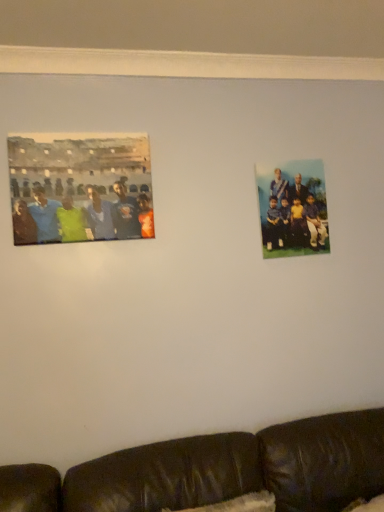
At what (x,y) coordinates should I click in order to perform the action: click on blue fabric group at upper right, which is counted as the 1th person, starting from the right. Please return your answer as a coordinate pair (x, y). This screenshot has width=384, height=512. Looking at the image, I should click on (294, 210).

At what (x,y) coordinates should I click in order to perform the action: click on black leather couch at lower center. Please return your answer as a coordinate pair (x, y). Looking at the image, I should click on click(219, 470).

What do you see at coordinates (82, 217) in the screenshot?
I see `matte green shirt at left, which is the second person from back to front` at bounding box center [82, 217].

At what (x,y) coordinates should I click in order to perform the action: click on blue fabric group at upper right, which is the 1th person in back-to-front order. Please return your answer as a coordinate pair (x, y). Looking at the image, I should click on (294, 210).

Between black leather couch at lower center and matte green shirt at left, the first person in the front-to-back sequence, which one has larger size?

Bigger between the two is black leather couch at lower center.

Is black leather couch at lower center facing away from matte green shirt at left, which is the second person from back to front?

black leather couch at lower center does not have its back to matte green shirt at left, which is the second person from back to front.

Consider the image. From the image's perspective, is black leather couch at lower center below matte green shirt at left, placed as the 1th person when sorted from left to right?

Indeed, from the image's perspective, black leather couch at lower center is shown beneath matte green shirt at left, placed as the 1th person when sorted from left to right.

Is black leather couch at lower center further to camera compared to matte green shirt at left, which is the second person from back to front?

No.

Between blue fabric group at upper right, which is counted as the 1th person, starting from the right, and matte green shirt at left, which is the second person from back to front, which one has smaller size?

blue fabric group at upper right, which is counted as the 1th person, starting from the right.

Is the position of blue fabric group at upper right, which is counted as the 1th person, starting from the right, more distant than that of matte green shirt at left, which is the 2th person from right to left?

Yes, it is.

Does point (313, 216) come behind point (119, 197)?

Yes, point (313, 216) is behind point (119, 197).

Between point (61, 204) and point (241, 472), which one is positioned behind?

Point (61, 204)

Considering the relative sizes of matte green shirt at left, placed as the 1th person when sorted from left to right, and black leather couch at lower center in the image provided, is matte green shirt at left, placed as the 1th person when sorted from left to right, thinner than black leather couch at lower center?

Yes.

Could you tell me if matte green shirt at left, which is the 2th person from right to left, is turned towards black leather couch at lower center?

No, matte green shirt at left, which is the 2th person from right to left, is not turned towards black leather couch at lower center.

Is matte green shirt at left, placed as the 1th person when sorted from left to right, not inside black leather couch at lower center?

matte green shirt at left, placed as the 1th person when sorted from left to right, is positioned outside black leather couch at lower center.

Considering their positions, is blue fabric group at upper right, which is counted as the 1th person, starting from the right, located in front of or behind black leather couch at lower center?

blue fabric group at upper right, which is counted as the 1th person, starting from the right, is positioned farther from the viewer than black leather couch at lower center.

From the image's perspective, would you say blue fabric group at upper right, the second person when ordered from left to right, is positioned over black leather couch at lower center?

Indeed, from the image's perspective, blue fabric group at upper right, the second person when ordered from left to right, is shown above black leather couch at lower center.

How far apart are blue fabric group at upper right, the second person when ordered from left to right, and black leather couch at lower center?

blue fabric group at upper right, the second person when ordered from left to right, and black leather couch at lower center are 34.29 inches apart.

Is black leather couch at lower center inside blue fabric group at upper right, which is the 1th person in back-to-front order?

Actually, black leather couch at lower center is outside blue fabric group at upper right, which is the 1th person in back-to-front order.

Would you say matte green shirt at left, the first person in the front-to-back sequence, is to the left or to the right of blue fabric group at upper right, which is counted as the 1th person, starting from the right, in the picture?

Clearly, matte green shirt at left, the first person in the front-to-back sequence, is on the left of blue fabric group at upper right, which is counted as the 1th person, starting from the right, in the image.

Is point (145, 237) farther from camera compared to point (284, 191)?

No, it is in front of (284, 191).

From the image's perspective, is matte green shirt at left, which is the 2th person from right to left, below blue fabric group at upper right, which is the second person in front-to-back order?

No.

Is matte green shirt at left, which is the second person from back to front, completely or partially outside of blue fabric group at upper right, the second person when ordered from left to right?

That's correct, matte green shirt at left, which is the second person from back to front, is outside of blue fabric group at upper right, the second person when ordered from left to right.

Looking at this image, is black leather couch at lower center positioned with its back to blue fabric group at upper right, the second person when ordered from left to right?

black leather couch at lower center is not turned away from blue fabric group at upper right, the second person when ordered from left to right.

From the picture: Which object is positioned more to the left, black leather couch at lower center or blue fabric group at upper right, which is the second person in front-to-back order?

black leather couch at lower center.

How different are the orientations of black leather couch at lower center and blue fabric group at upper right, which is counted as the 1th person, starting from the right, in degrees?

They differ by 0.0974 degrees in their facing directions.

Are black leather couch at lower center and blue fabric group at upper right, the second person when ordered from left to right, beside each other?

No, black leather couch at lower center is not next to blue fabric group at upper right, the second person when ordered from left to right.

Where is `person that is the 2nd one when counting upward from the black leather couch at lower center (from the image's perspective)`? person that is the 2nd one when counting upward from the black leather couch at lower center (from the image's perspective) is located at coordinates (82, 217).

Locate an element on the screen. person below the matte green shirt at left, which is the 2th person from right to left (from the image's perspective) is located at coordinates (294, 210).

Looking at the image, which one is located further to black leather couch at lower center, blue fabric group at upper right, which is counted as the 1th person, starting from the right, or matte green shirt at left, which is the second person from back to front?

matte green shirt at left, which is the second person from back to front, is further to black leather couch at lower center.

In the scene shown: Which object lies nearer to the anchor point matte green shirt at left, placed as the 1th person when sorted from left to right, blue fabric group at upper right, which is the 1th person in back-to-front order, or black leather couch at lower center?

blue fabric group at upper right, which is the 1th person in back-to-front order, is positioned closer to the anchor matte green shirt at left, placed as the 1th person when sorted from left to right.

In the scene shown: Estimate the real-world distances between objects in this image. Which object is further from black leather couch at lower center, matte green shirt at left, which is the 2th person from right to left, or blue fabric group at upper right, the second person when ordered from left to right?

matte green shirt at left, which is the 2th person from right to left, is positioned further to the anchor black leather couch at lower center.

Looking at the image, which one is located further to blue fabric group at upper right, which is the 1th person in back-to-front order, matte green shirt at left, the first person in the front-to-back sequence, or black leather couch at lower center?

black leather couch at lower center is further to blue fabric group at upper right, which is the 1th person in back-to-front order.

Estimate the real-world distances between objects in this image. Which object is further from blue fabric group at upper right, which is the second person in front-to-back order, black leather couch at lower center or matte green shirt at left, the first person in the front-to-back sequence?

black leather couch at lower center is further to blue fabric group at upper right, which is the second person in front-to-back order.

Estimate the real-world distances between objects in this image. Which object is further from matte green shirt at left, which is the second person from back to front, black leather couch at lower center or blue fabric group at upper right, the second person when ordered from left to right?

black leather couch at lower center is positioned further to the anchor matte green shirt at left, which is the second person from back to front.

Locate an element on the screen. This screenshot has width=384, height=512. person between matte green shirt at left, which is the 2th person from right to left, and black leather couch at lower center vertically is located at coordinates (294, 210).